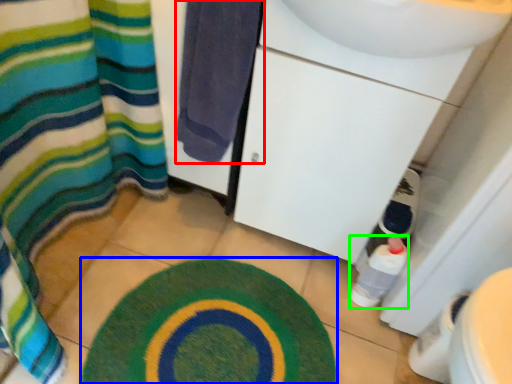
Question: Which is nearer to the towel (highlighted by a red box)? bath mat (highlighted by a blue box) or bottle (highlighted by a green box).

Choices:
 (A) bath mat
 (B) bottle

Answer: (A)